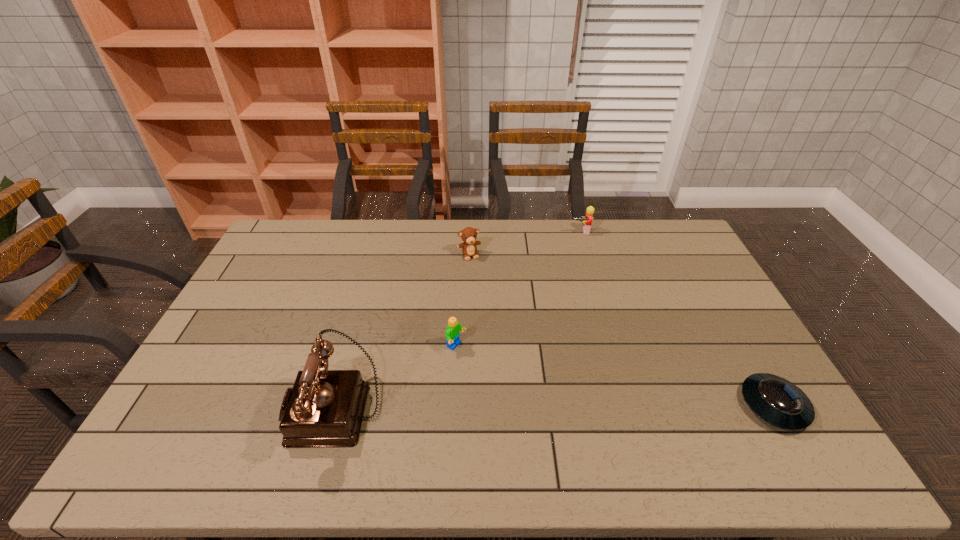
This screenshot has height=540, width=960. In order to click on blank space at the right edge in this screenshot , I will do `click(724, 324)`.

Locate an element on the screen. vacant space at the far left corner of the desktop is located at coordinates (319, 231).

In the image, there is a desktop. Identify the location of blank space at the near left corner. This screenshot has height=540, width=960. (159, 427).

In the image, there is a desktop. Identify the location of blank space at the far right corner. (664, 249).

The image size is (960, 540). In the image, there is a desktop. Identify the location of vacant space at the near right corner. (752, 419).

Locate an element on the screen. free point between the second farthest object and the farthest object is located at coordinates (525, 243).

This screenshot has width=960, height=540. Identify the location of empty space that is in between the teddy bear and the rightmost object. (621, 330).

In order to click on vacant point located between the second farthest object and the saucer in this screenshot , I will do `click(621, 330)`.

Locate an element on the screen. The image size is (960, 540). vacant region between the right Lego and the telephone is located at coordinates [x=458, y=319].

At what (x,y) coordinates should I click in order to perform the action: click on empty location between the farthest object and the telephone. Please return your answer as a coordinate pair (x, y). Looking at the image, I should click on (458, 319).